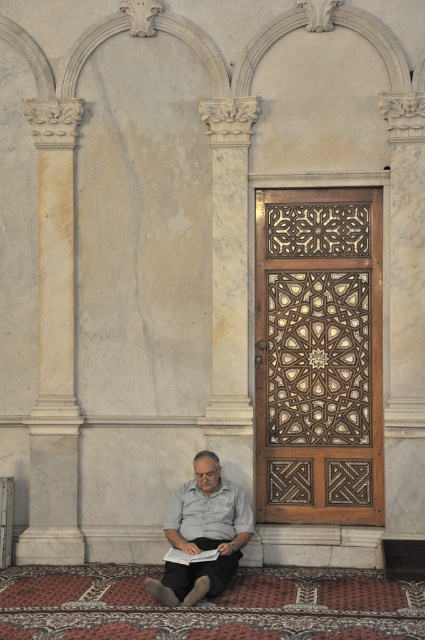
Which of these two, white marble column at left or white paper book at lower center, stands taller?

With more height is white marble column at left.

Which is above, white marble column at left or white paper book at lower center?

white marble column at left is higher up.

The height and width of the screenshot is (640, 425). What do you see at coordinates (54, 346) in the screenshot?
I see `white marble column at left` at bounding box center [54, 346].

Where is `white marble column at left`? The width and height of the screenshot is (425, 640). white marble column at left is located at coordinates (54, 346).

Who is taller, gray cotton shirt at lower center or white cotton shirt at lower center?

Standing taller between the two is gray cotton shirt at lower center.

Does gray cotton shirt at lower center appear on the right side of white cotton shirt at lower center?

No, gray cotton shirt at lower center is not to the right of white cotton shirt at lower center.

This screenshot has width=425, height=640. Find the location of `gray cotton shirt at lower center`. gray cotton shirt at lower center is located at coordinates (203, 534).

Can you confirm if white cotton shirt at lower center is smaller than white paper book at lower center?

No, white cotton shirt at lower center is not smaller than white paper book at lower center.

Can you confirm if white cotton shirt at lower center is positioned to the left of white paper book at lower center?

No, white cotton shirt at lower center is not to the left of white paper book at lower center.

Is point (244, 515) positioned before point (210, 552)?

No.

Where is `white cotton shirt at lower center`? The image size is (425, 640). white cotton shirt at lower center is located at coordinates (209, 513).